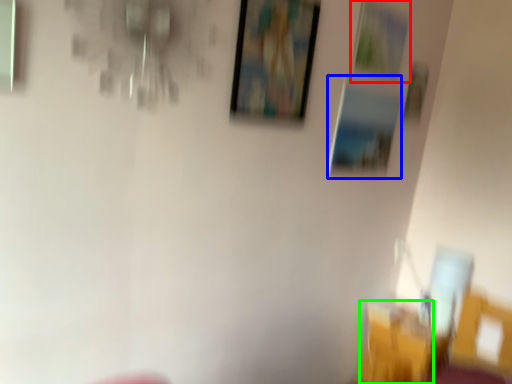
Question: Based on their relative distances, which object is nearer to picture frame (highlighted by a red box)? Choose from picture frame (highlighted by a blue box) and chair (highlighted by a green box).

Choices:
 (A) picture frame
 (B) chair

Answer: (A)